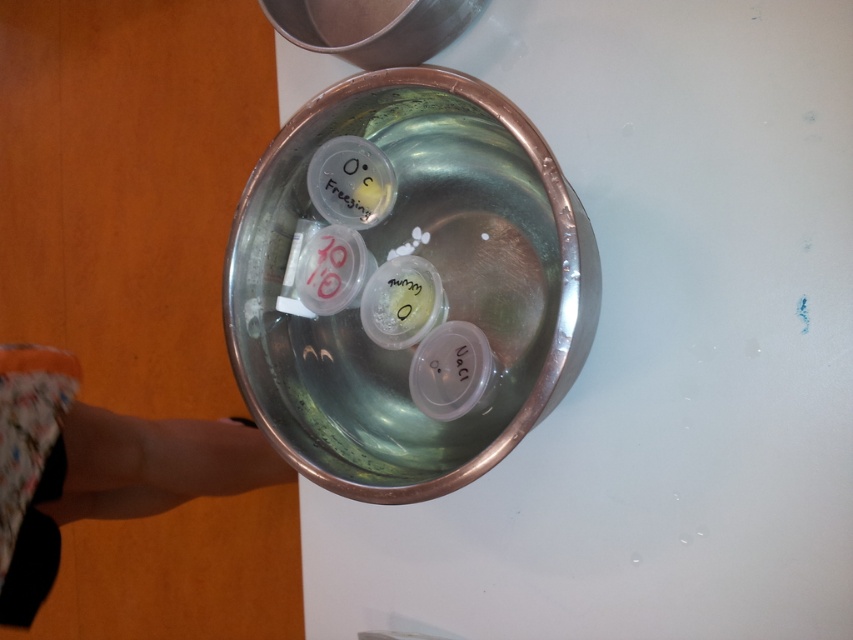
You are organizing a lab and need to place a new container on the white surface. The shiny metallic bowl at center is already there. Where should you place the new container to avoid overlapping with the bowl?

The shiny metallic bowl at center is located at point (x=438, y=273). To avoid overlapping, place the new container in an area not occupied by the bowl.

You have a small toy car that is 10 cm wide. You want to place it on the white surface next to the shiny metallic bowl at center and the floral fabric leg at lower left. Which object can the toy car fit next to without overlapping?

The toy car can fit next to the floral fabric leg at lower left because the shiny metallic bowl at center is wider than the floral fabric leg at lower left, so the leg has enough space for the car.

You are a lab technician who needs to place a 12 inch long tool on the table. The shiny metallic bowl at center and the floral fabric leg at lower left are on the table. Is there enough space between them to place the tool horizontally?

The shiny metallic bowl at center is only 10.18 inches from the floral fabric leg at lower left, so there isn not enough space to place a 12 inch long tool horizontally between them.